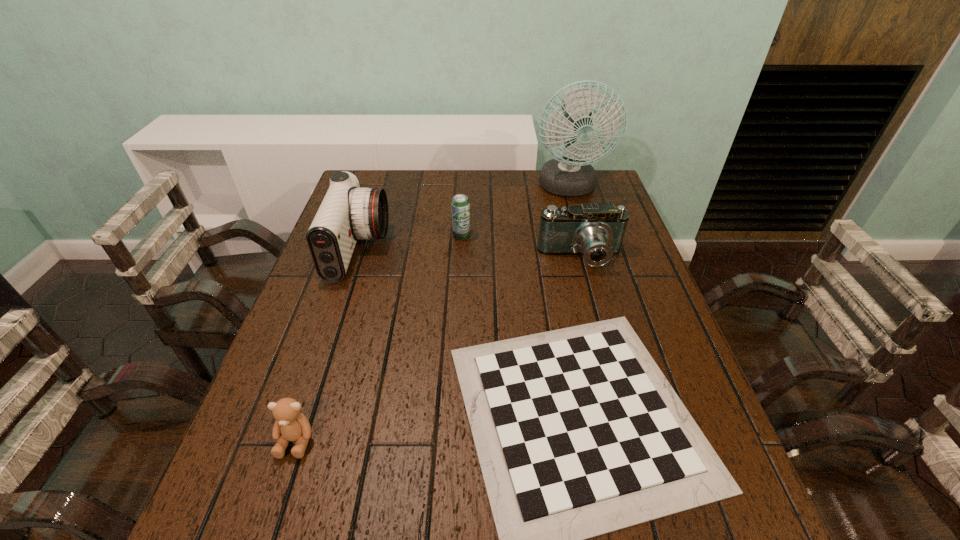
Find the location of a particular element. vacant space situated on the right of the beer can is located at coordinates (523, 235).

This screenshot has height=540, width=960. Find the location of `vacant region located on the face of the second shortest object`. vacant region located on the face of the second shortest object is located at coordinates (264, 537).

This screenshot has width=960, height=540. Find the location of `object that is at the far edge`. object that is at the far edge is located at coordinates (570, 175).

The image size is (960, 540). Find the location of `camcorder positioned at the left edge`. camcorder positioned at the left edge is located at coordinates (348, 212).

In order to click on teddy bear that is at the left edge in this screenshot , I will do click(x=291, y=425).

Locate an element on the screen. This screenshot has height=540, width=960. fan situated at the right edge is located at coordinates (570, 175).

The width and height of the screenshot is (960, 540). I want to click on camcorder that is positioned at the right edge, so click(x=596, y=231).

Locate an element on the screen. object that is at the far right corner is located at coordinates (570, 175).

Where is `vacant area at the far edge`? The height and width of the screenshot is (540, 960). vacant area at the far edge is located at coordinates (452, 197).

Find the location of a particular element. Image resolution: width=960 pixels, height=540 pixels. vacant area at the near edge of the desktop is located at coordinates (418, 514).